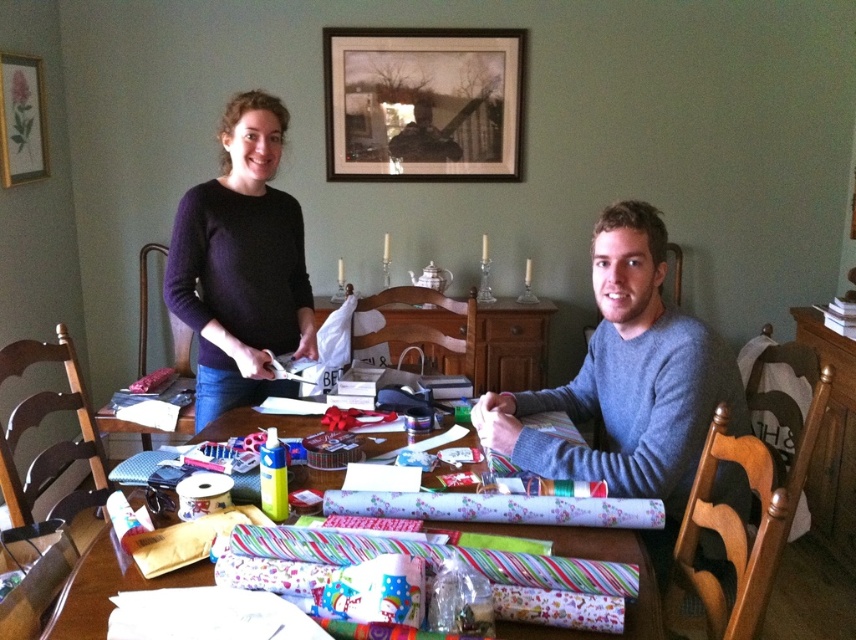
Question: Among these points, which one is farthest from the camera?

Choices:
 (A) (34, 83)
 (B) (236, 124)

Answer: (A)

Question: Which point is farther to the camera?

Choices:
 (A) gold-framed picture at upper left
 (B) wrapping paper rolls at center
 (C) gray sweater at center

Answer: (A)

Question: Is gray sweater at center further to the viewer compared to gold-framed picture at upper left?

Choices:
 (A) yes
 (B) no

Answer: (B)

Question: Which point is closer to the camera?

Choices:
 (A) gray sweater at center
 (B) matte black sweater at upper center
 (C) wooden picture frame at upper center

Answer: (A)

Question: Does gray sweater at center lie behind dark purple sweater at upper left?

Choices:
 (A) no
 (B) yes

Answer: (A)

Question: Does gray sweater at center have a lesser width compared to wooden picture frame at upper center?

Choices:
 (A) yes
 (B) no

Answer: (A)